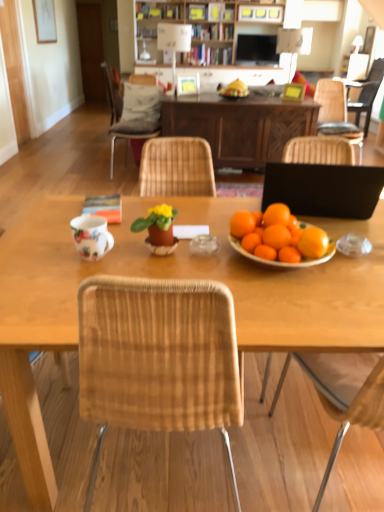
Describe the element at coordinates (157, 225) in the screenshot. I see `matte clay pot at center` at that location.

Measure the distance between point (371, 322) and camera.

Point (371, 322) is 96.20 centimeters away from camera.

At what (x,y) coordinates should I click in order to perform the action: click on wooden table at center. Please return your answer as a coordinate pair (x, y). The width and height of the screenshot is (384, 512). Looking at the image, I should click on (239, 126).

The image size is (384, 512). Describe the element at coordinates (239, 126) in the screenshot. I see `wooden table at center` at that location.

This screenshot has width=384, height=512. What do you see at coordinates (293, 92) in the screenshot?
I see `wooden picture frame at center, acting as the first picture frame starting from the right` at bounding box center [293, 92].

Where is `woven wood chair at upper left, the second chair positioned from the back`? The height and width of the screenshot is (512, 384). woven wood chair at upper left, the second chair positioned from the back is located at coordinates pyautogui.click(x=138, y=115).

The width and height of the screenshot is (384, 512). Identify the location of matte white picture frame at center, the second picture frame viewed from the front. (188, 84).

From the image's perspective, is white fabric pillow at upper left below woven wood chair at upper left, which ranks as the 3th chair in right-to-left order?

No, from the image's perspective, white fabric pillow at upper left is not below woven wood chair at upper left, which ranks as the 3th chair in right-to-left order.

Based on the photo, does white fabric pillow at upper left have a lesser width compared to woven wood chair at upper left, which ranks as the 3th chair in right-to-left order?

Correct, the width of white fabric pillow at upper left is less than that of woven wood chair at upper left, which ranks as the 3th chair in right-to-left order.

Is white fabric pillow at upper left facing towards woven wood chair at upper left, which ranks as the 3th chair in right-to-left order?

Yes, white fabric pillow at upper left is facing woven wood chair at upper left, which ranks as the 3th chair in right-to-left order.

Is white fabric pillow at upper left situated inside woven wood chair at upper left, which ranks as the 3th chair in right-to-left order, or outside?

white fabric pillow at upper left is spatially positioned inside woven wood chair at upper left, which ranks as the 3th chair in right-to-left order.

From the image's perspective, which object appears higher, matte white picture frame at center, the second picture frame ordered from the bottom, or woven wood chair at right, the 2th chair in the right-to-left sequence?

matte white picture frame at center, the second picture frame ordered from the bottom, from the image's perspective.

Starting from the matte white picture frame at center, the second picture frame when ordered from left to right, which chair is the 2nd one in front? Please provide its 2D coordinates.

[(335, 111)]

Considering the relative sizes of matte white picture frame at center, the second picture frame when ordered from left to right, and woven wood chair at right, which is the 1th chair from front to back, in the image provided, is matte white picture frame at center, the second picture frame when ordered from left to right, smaller than woven wood chair at right, which is the 1th chair from front to back,?

Yes, matte white picture frame at center, the second picture frame when ordered from left to right, is smaller than woven wood chair at right, which is the 1th chair from front to back.

Does matte white picture frame at center, the second picture frame viewed from the front, have a greater width compared to woven wood chair at right, which is the 3th chair in back-to-front order?

Incorrect, the width of matte white picture frame at center, the second picture frame viewed from the front, does not surpass that of woven wood chair at right, which is the 3th chair in back-to-front order.

The width and height of the screenshot is (384, 512). I want to click on desk on the right of the woven wood chair at upper left, the second chair positioned from the back, so click(169, 276).

From the picture: From a real-world perspective, is wooden table at center on top of woven wood chair at upper left, the first chair viewed from the left?

No.

Considering their positions, is wooden table at center located in front of or behind woven wood chair at upper left, the second chair positioned from the back?

In the image, wooden table at center appears in front of woven wood chair at upper left, the second chair positioned from the back.

Between wooden table at center and woven wood chair at upper left, the second chair positioned from the back, which one has smaller width?

woven wood chair at upper left, the second chair positioned from the back, is thinner.

How different are the orientations of matte white picture frame at center, the second picture frame viewed from the front, and white fabric pillow at upper left in degrees?

There is a 48.9-degree angle between the facing directions of matte white picture frame at center, the second picture frame viewed from the front, and white fabric pillow at upper left.

You are a GUI agent. You are given a task and a screenshot of the screen. Output one action in this format:
    pyautogui.click(x=<x>, y=<y>)
    Task: Click on the 2nd picture frame directly above the white fabric pillow at upper left (from a real-world perspective)
    The image size is (384, 512).
    Given the screenshot: What is the action you would take?
    pyautogui.click(x=188, y=84)

In the image, is matte white picture frame at center, the second picture frame when ordered from left to right, on the left side or the right side of white fabric pillow at upper left?

In the image, matte white picture frame at center, the second picture frame when ordered from left to right, appears on the right side of white fabric pillow at upper left.

How many degrees apart are the facing directions of black matte laptop at right and white plastic lamp at upper center?

They differ by 178 degrees in their facing directions.

From the image's perspective, is black matte laptop at right above or below white plastic lamp at upper center?

black matte laptop at right is situated lower than white plastic lamp at upper center in the image.

Considering the relative positions of black matte laptop at right and white plastic lamp at upper center in the image provided, is black matte laptop at right to the left of white plastic lamp at upper center from the viewer's perspective?

In fact, black matte laptop at right is to the right of white plastic lamp at upper center.

Is matte white picture frame at upper left, the first picture frame from the back, to the left or to the right of woven wood chair at right, the 2th chair in the right-to-left sequence, in the image?

Based on their positions, matte white picture frame at upper left, the first picture frame from the back, is located to the left of woven wood chair at right, the 2th chair in the right-to-left sequence.

From the picture: How far apart are matte white picture frame at upper left, the third picture frame from the bottom, and woven wood chair at right, the 2th chair in the right-to-left sequence?

The distance of matte white picture frame at upper left, the third picture frame from the bottom, from woven wood chair at right, the 2th chair in the right-to-left sequence, is 3.58 meters.

Based on the photo, from a real-world perspective, is matte white picture frame at upper left, which ranks as the 3th picture frame in front-to-back order, physically located above or below woven wood chair at right, which is the 1th chair from front to back?

From a real-world perspective, matte white picture frame at upper left, which ranks as the 3th picture frame in front-to-back order, is physically above woven wood chair at right, which is the 1th chair from front to back.

Are white fabric pillow at upper left and white plastic lamp at upper center beside each other?

No, white fabric pillow at upper left is not beside white plastic lamp at upper center.

Find the location of a particular element. This screenshot has width=384, height=512. lamp lying on the right of white fabric pillow at upper left is located at coordinates (174, 42).

Considering the sizes of white fabric pillow at upper left and white plastic lamp at upper center in the image, is white fabric pillow at upper left taller or shorter than white plastic lamp at upper center?

white fabric pillow at upper left is shorter than white plastic lamp at upper center.

From the image's perspective, between white fabric pillow at upper left and white plastic lamp at upper center, who is located below?

white fabric pillow at upper left, from the image's perspective.

The image size is (384, 512). I want to click on the 1st chair in front of the white fabric pillow at upper left, starting your count from the anchor, so click(x=138, y=115).

From the image's perspective, starting from the matte white picture frame at center, marked as the second picture frame in a right-to-left arrangement, which chair is the 1st one below? Please provide its 2D coordinates.

[(335, 111)]

Based on their spatial positions, is wooden picture frame at center, acting as the first picture frame starting from the right, or matte black television at upper center further from matte white picture frame at upper left, the third picture frame from the bottom?

wooden picture frame at center, acting as the first picture frame starting from the right.

Based on their spatial positions, is wooden table at center or matte white picture frame at upper left, the third picture frame from the bottom, closer to black matte laptop at right?

wooden table at center.

Based on their spatial positions, is woven wood chair at upper left, the second chair positioned from the back, or matte white picture frame at upper left, which ranks as the first picture frame in top-to-bottom order, closer to woven wood chair at right, which is the 2th chair from left to right?

woven wood chair at upper left, the second chair positioned from the back.

Based on their spatial positions, is wooden picture frame at center, acting as the third picture frame starting from the back, or woven wood chair at upper left, the second chair in the front-to-back sequence, closer to wooden cabinet at upper center?

The object closer to wooden cabinet at upper center is woven wood chair at upper left, the second chair in the front-to-back sequence.

When comparing their distances from woven wood chair at upper right, which appears as the 1th chair when viewed from the right, does wooden picture frame at center, the first picture frame from the front, or white plastic lamp at upper center seem further?

white plastic lamp at upper center.

Which object lies nearer to the anchor point wooden table at center, white fabric pillow at upper left or woven wood chair at upper left, the second chair in the front-to-back sequence?

woven wood chair at upper left, the second chair in the front-to-back sequence, is closer to wooden table at center.

From the image, which object appears to be nearer to wooden table at center, white plastic lamp at upper center or floral ceramic mug at center?

Based on the image, floral ceramic mug at center appears to be nearer to wooden table at center.

From the image, which object appears to be farther from woven wood chair at right, which is the 1th chair from front to back, white plastic lamp at upper center or wooden picture frame at center, acting as the first picture frame starting from the right?

Based on the image, white plastic lamp at upper center appears to be further to woven wood chair at right, which is the 1th chair from front to back.

What are the coordinates of `houseplant located between floral ceramic mug at center and wooden table at center in the left-right direction` in the screenshot? It's located at [157, 225].

What are the coordinates of `laptop between wooden table at center and matte white picture frame at upper left, which ranks as the first picture frame in top-to-bottom order, from front to back` in the screenshot? It's located at (324, 189).

Find the location of a particular element. This screenshot has height=512, width=384. lamp between matte clay pot at center and wooden picture frame at center, which is the third picture frame in left-to-right order, from front to back is located at coordinates (174, 42).

The height and width of the screenshot is (512, 384). Identify the location of laptop between wooden table at center and woven wood chair at upper left, which ranks as the 3th chair in right-to-left order, along the z-axis. (324, 189).